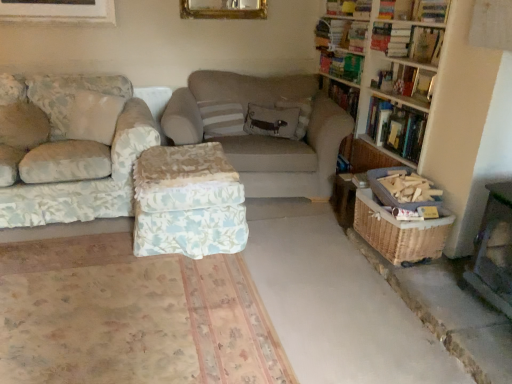
I want to click on vacant region to the left of woven wicker basket at lower right, so click(x=310, y=221).